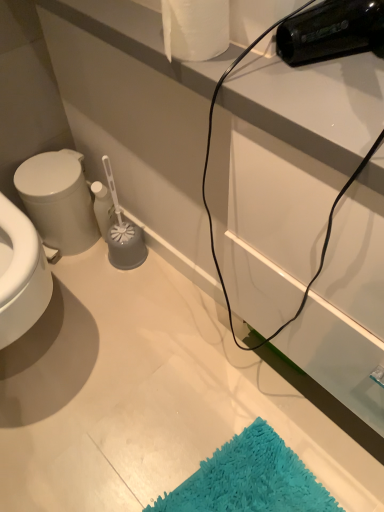
Question: Does white glossy bidet at left have a greater height compared to white matte toilet paper at upper center?

Choices:
 (A) yes
 (B) no

Answer: (A)

Question: Is white glossy bidet at left touching white matte toilet paper at upper center?

Choices:
 (A) yes
 (B) no

Answer: (B)

Question: From the image's perspective, is white glossy bidet at left on top of white matte toilet paper at upper center?

Choices:
 (A) yes
 (B) no

Answer: (B)

Question: Does white glossy bidet at left have a lesser width compared to white matte toilet paper at upper center?

Choices:
 (A) no
 (B) yes

Answer: (A)

Question: Does white glossy bidet at left turn towards white matte toilet paper at upper center?

Choices:
 (A) no
 (B) yes

Answer: (A)

Question: Would you say white glossy bidet at left is a long distance from white matte toilet paper at upper center?

Choices:
 (A) no
 (B) yes

Answer: (A)

Question: From the image's perspective, is white matte toilet paper at upper center under white glossy bidet at left?

Choices:
 (A) yes
 (B) no

Answer: (B)

Question: From a real-world perspective, is white matte toilet paper at upper center beneath white glossy bidet at left?

Choices:
 (A) no
 (B) yes

Answer: (A)

Question: Can white glossy bidet at left be found inside white matte toilet paper at upper center?

Choices:
 (A) yes
 (B) no

Answer: (B)

Question: Can you confirm if white matte toilet paper at upper center is positioned to the right of white glossy bidet at left?

Choices:
 (A) yes
 (B) no

Answer: (A)

Question: Can you confirm if white matte toilet paper at upper center is taller than white glossy bidet at left?

Choices:
 (A) yes
 (B) no

Answer: (B)

Question: Are white matte toilet paper at upper center and white glossy bidet at left beside each other?

Choices:
 (A) yes
 (B) no

Answer: (B)

Question: From the image's perspective, is white matte toilet paper at upper center located above or below white glossy bidet at left?

Choices:
 (A) above
 (B) below

Answer: (A)